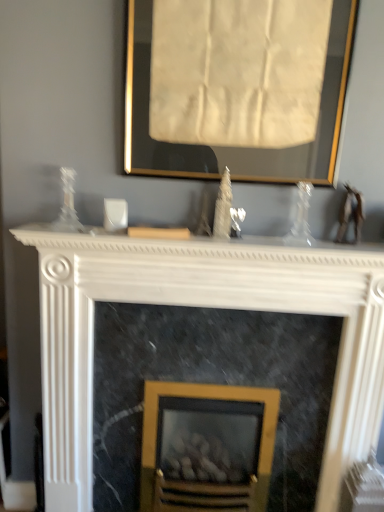
Question: Is white marble fireplace at center shorter than marble fireplace at center, marked as the 2th fireplace in a back-to-front arrangement?

Choices:
 (A) no
 (B) yes

Answer: (B)

Question: From the image's perspective, does white marble fireplace at center appear lower than marble fireplace at center, acting as the second fireplace starting from the front?

Choices:
 (A) yes
 (B) no

Answer: (B)

Question: Does white marble fireplace at center touch marble fireplace at center, acting as the second fireplace starting from the front?

Choices:
 (A) yes
 (B) no

Answer: (B)

Question: From a real-world perspective, is white marble fireplace at center physically above marble fireplace at center, acting as the second fireplace starting from the front?

Choices:
 (A) no
 (B) yes

Answer: (B)

Question: Is white marble fireplace at center turned away from marble fireplace at center, acting as the second fireplace starting from the front?

Choices:
 (A) yes
 (B) no

Answer: (B)

Question: Is white marble fireplace at center wider or thinner than white marble fireplace at center, which is counted as the 1th fireplace, starting from the front?

Choices:
 (A) thin
 (B) wide

Answer: (B)

Question: Considering the relative positions of white marble fireplace at center and white marble fireplace at center, which is counted as the 1th fireplace, starting from the front, in the image provided, is white marble fireplace at center to the left or to the right of white marble fireplace at center, which is counted as the 1th fireplace, starting from the front,?

Choices:
 (A) left
 (B) right

Answer: (A)

Question: From the image's perspective, is white marble fireplace at center positioned above or below white marble fireplace at center, which is counted as the 1th fireplace, starting from the front?

Choices:
 (A) above
 (B) below

Answer: (A)

Question: Considering the positions of point (336, 245) and point (173, 241), is point (336, 245) closer or farther from the camera than point (173, 241)?

Choices:
 (A) closer
 (B) farther

Answer: (B)

Question: Considering the positions of point (319, 494) and point (139, 174), is point (319, 494) closer or farther from the camera than point (139, 174)?

Choices:
 (A) farther
 (B) closer

Answer: (A)

Question: Looking at the image, does white marble fireplace at center, which is counted as the 1th fireplace, starting from the front, seem bigger or smaller compared to gold-framed artwork at upper center?

Choices:
 (A) big
 (B) small

Answer: (A)

Question: From a real-world perspective, relative to gold-framed artwork at upper center, is white marble fireplace at center, which is counted as the 1th fireplace, starting from the front, vertically above or below?

Choices:
 (A) below
 (B) above

Answer: (A)

Question: Which is correct: white marble fireplace at center, the 3th fireplace in the back-to-front sequence, is inside gold-framed artwork at upper center, or outside of it?

Choices:
 (A) inside
 (B) outside

Answer: (B)

Question: From a real-world perspective, is gold-framed fireplace at center, which appears as the 3th fireplace when viewed from the front, physically located above or below white marble fireplace at center, the 3th fireplace in the back-to-front sequence?

Choices:
 (A) above
 (B) below

Answer: (B)

Question: Based on their sizes in the image, would you say gold-framed fireplace at center, acting as the 1th fireplace starting from the back, is bigger or smaller than white marble fireplace at center, which is counted as the 1th fireplace, starting from the front?

Choices:
 (A) small
 (B) big

Answer: (A)